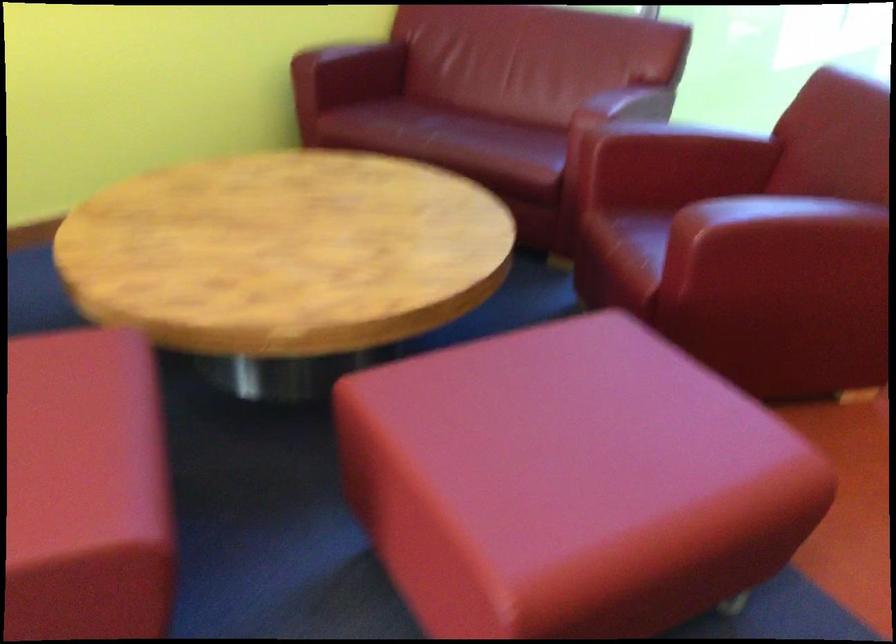
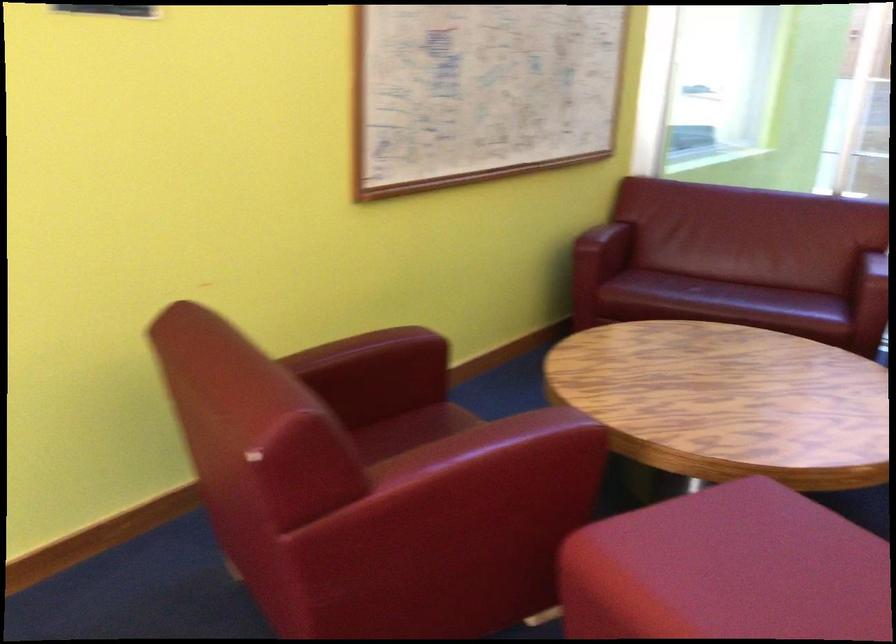
In the second image, find the point that corresponds to [575,144] in the first image.

(872, 306)